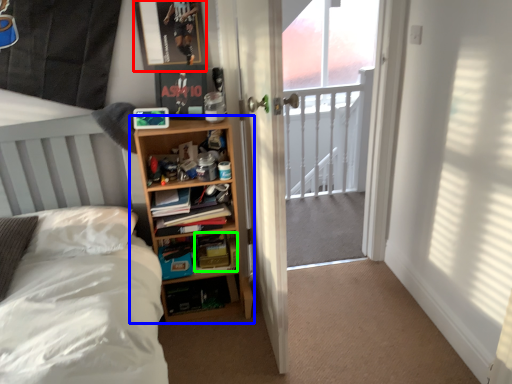
Question: Which object is the farthest from picture frame (highlighted by a red box)? Choose among these: shelf (highlighted by a blue box) or paperback book (highlighted by a green box).

Choices:
 (A) shelf
 (B) paperback book

Answer: (B)